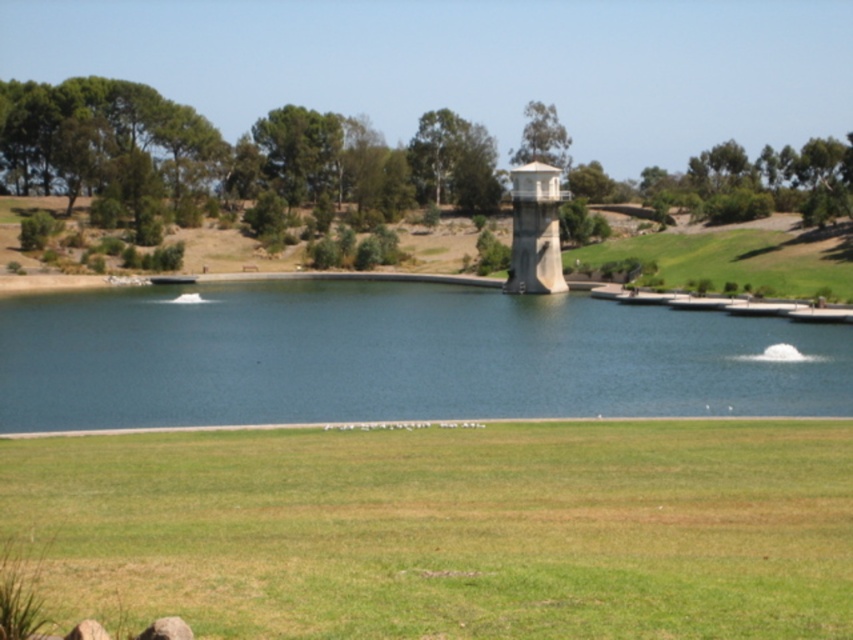
Question: Which of the following is the closest to the observer?

Choices:
 (A) blue smooth water at center
 (B) green grass at lower center
 (C) white concrete water tower at center

Answer: (B)

Question: Is green grass at lower center positioned behind blue smooth water at center?

Choices:
 (A) yes
 (B) no

Answer: (B)

Question: Which object is the closest to the blue smooth water at center?

Choices:
 (A) white concrete water tower at center
 (B) green grass at lower center

Answer: (A)

Question: Can you confirm if green grass at lower center is positioned to the left of white concrete water tower at center?

Choices:
 (A) yes
 (B) no

Answer: (A)

Question: Where is blue smooth water at center located in relation to white concrete water tower at center in the image?

Choices:
 (A) right
 (B) left

Answer: (B)

Question: Which object is positioned farthest from the blue smooth water at center?

Choices:
 (A) white concrete water tower at center
 (B) green grass at lower center

Answer: (B)